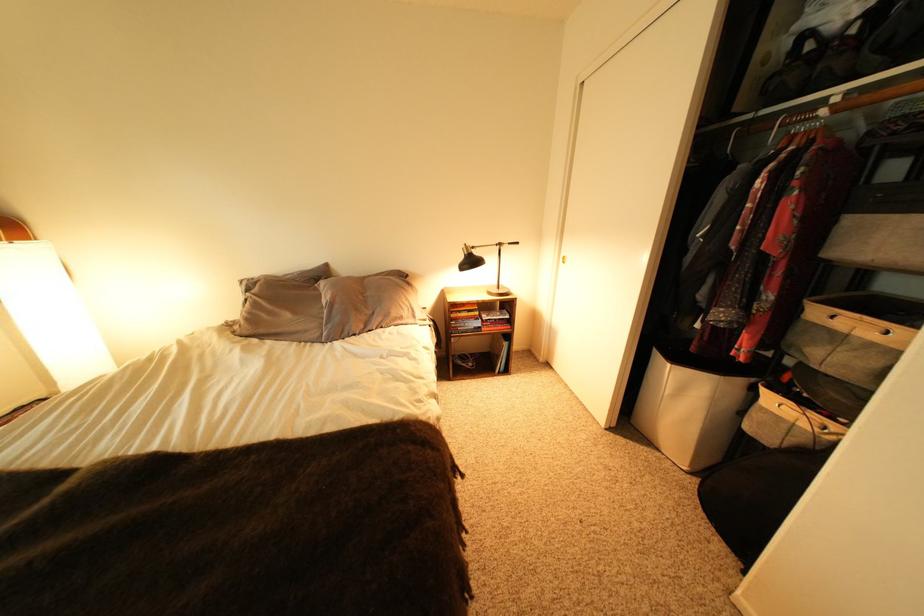
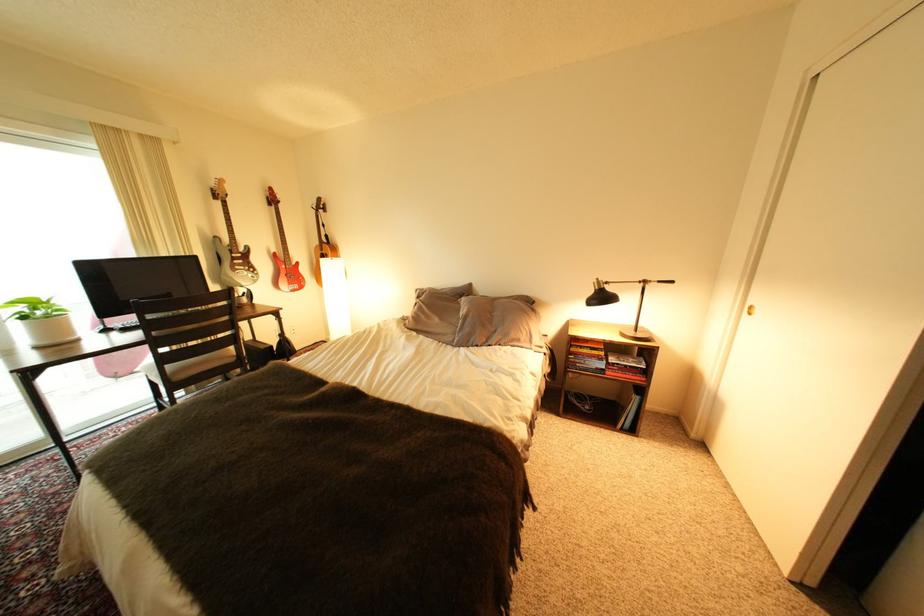
Question: The camera is either moving clockwise (left) or counter-clockwise (right) around the object. The first image is from the beginning of the video and the second image is from the end. Is the camera moving left or right when shooting the video?

Choices:
 (A) Left
 (B) Right

Answer: (B)